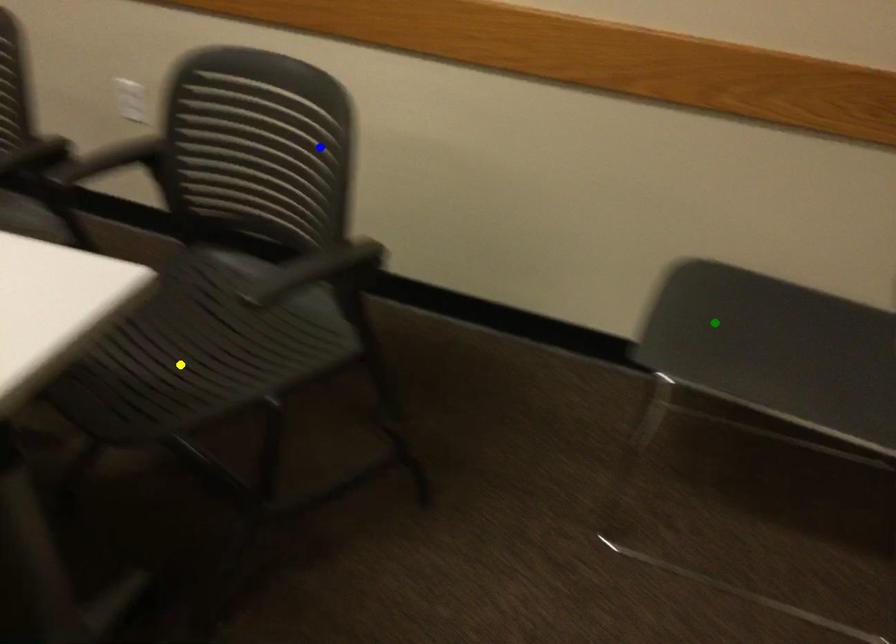
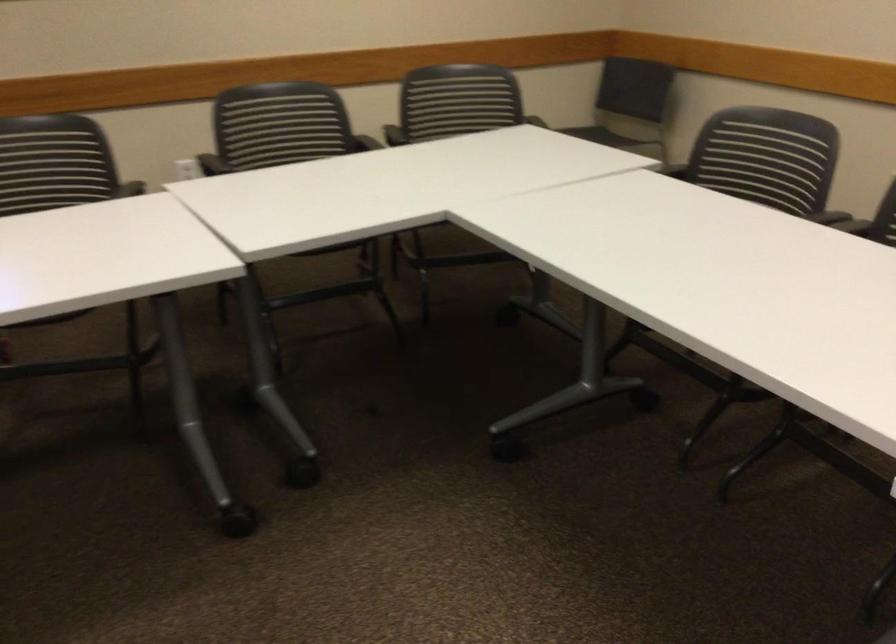
I am providing you with two images of the same scene from different viewpoints. Three points are marked in image1. Which point corresponds to a part or object that is occluded in image2?In image1, three points are marked. Which of them correspond to a part or object that is occluded in image2?Among the three points shown in image1, which one corresponds to a part or object that is no longer visible due to occlusion in image2?

Invisible in image2: yellow point, green point.